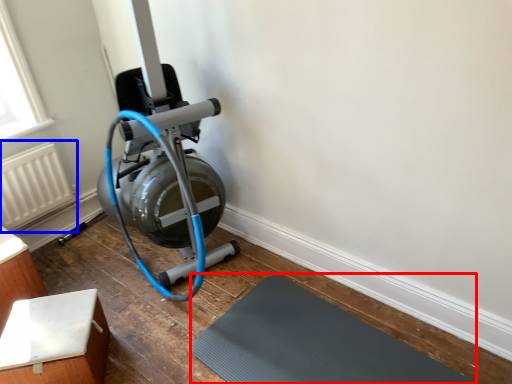
Question: Which object appears farthest to the camera in this image, bath mat (highlighted by a red box) or radiator (highlighted by a blue box)?

Choices:
 (A) bath mat
 (B) radiator

Answer: (B)